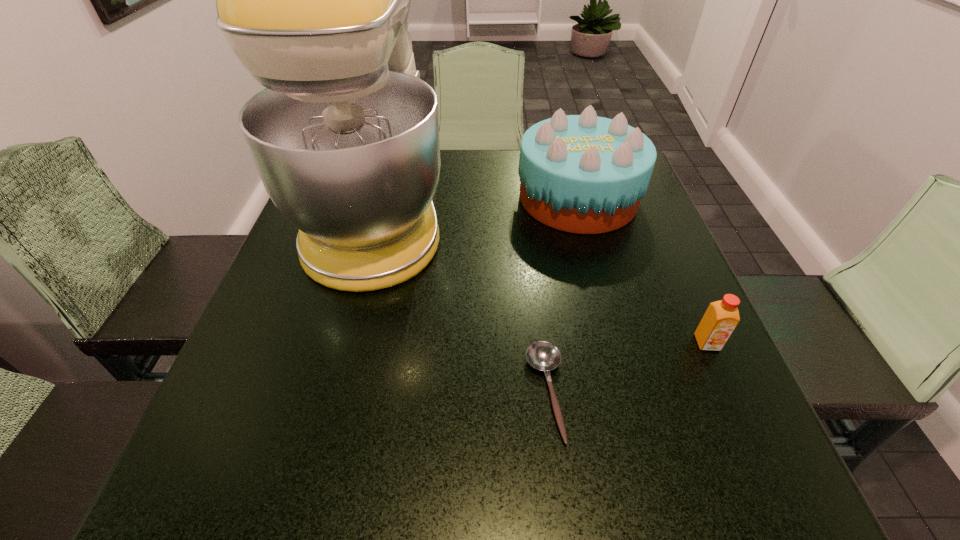
The image size is (960, 540). In order to click on the leftmost object in this screenshot , I will do point(313,0).

The height and width of the screenshot is (540, 960). In order to click on the tallest object in this screenshot , I will do pos(313,0).

The width and height of the screenshot is (960, 540). What are the coordinates of `cake` in the screenshot? It's located at (584, 174).

This screenshot has height=540, width=960. I want to click on orange juice, so click(x=721, y=318).

The width and height of the screenshot is (960, 540). In order to click on ladle in this screenshot , I will do `click(544, 356)`.

You are a GUI agent. You are given a task and a screenshot of the screen. Output one action in this format:
    pyautogui.click(x=<x>, y=<y>)
    Task: Click on the vacant space located on the side of the mixer with the control knob
    
    Given the screenshot: What is the action you would take?
    pyautogui.click(x=502, y=212)

Identify the location of blank space located 0.270m on the front of the cake. (613, 330).

Where is `vacant space located on the front and back of the third tallest object`? This screenshot has height=540, width=960. vacant space located on the front and back of the third tallest object is located at coordinates (772, 488).

The width and height of the screenshot is (960, 540). I want to click on free space located on the left of the shortest object, so click(395, 393).

Find the location of a particular element. The height and width of the screenshot is (540, 960). mixer located at the far edge is located at coordinates (313, 0).